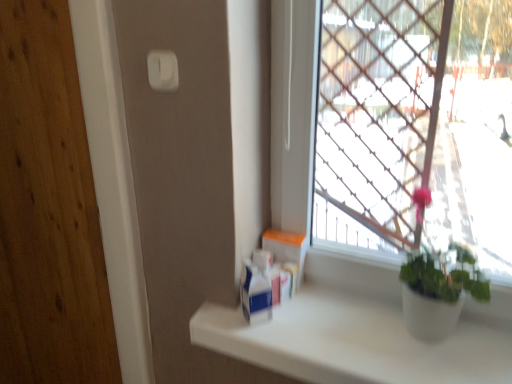
Where is `spots to the right of white plastic container at center`? This screenshot has height=384, width=512. spots to the right of white plastic container at center is located at coordinates (343, 308).